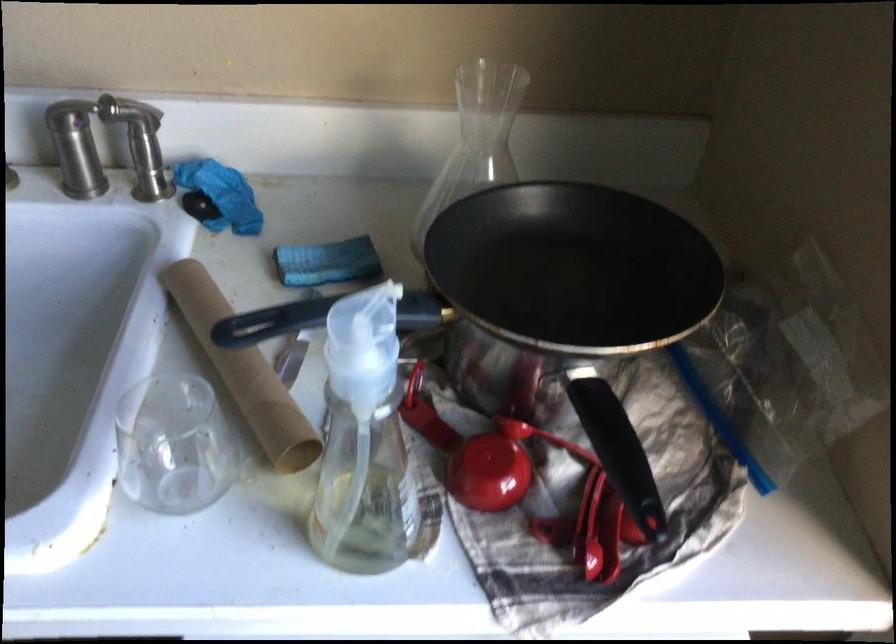
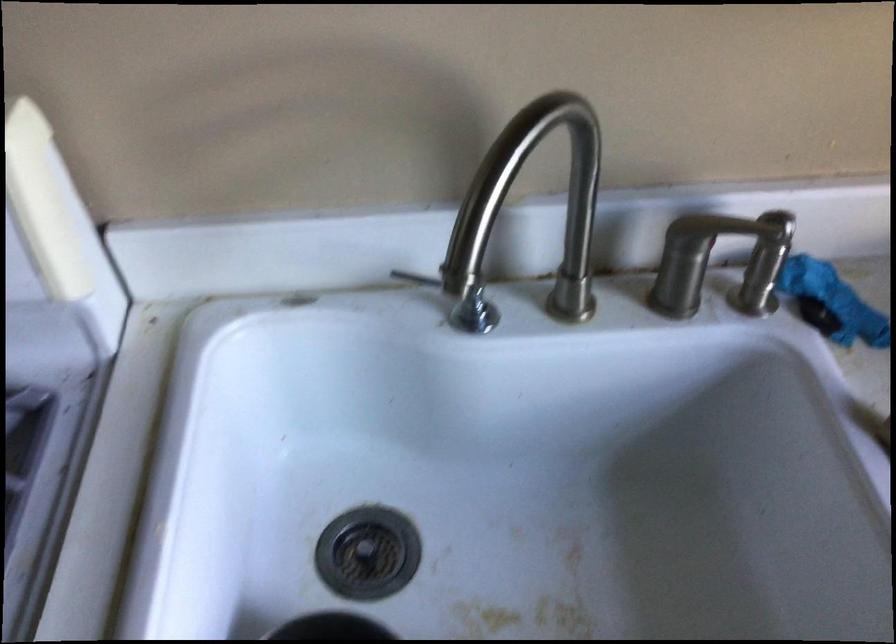
Question: How did the camera likely rotate?

Choices:
 (A) Left
 (B) Right
 (C) Up
 (D) Down

Answer: (D)